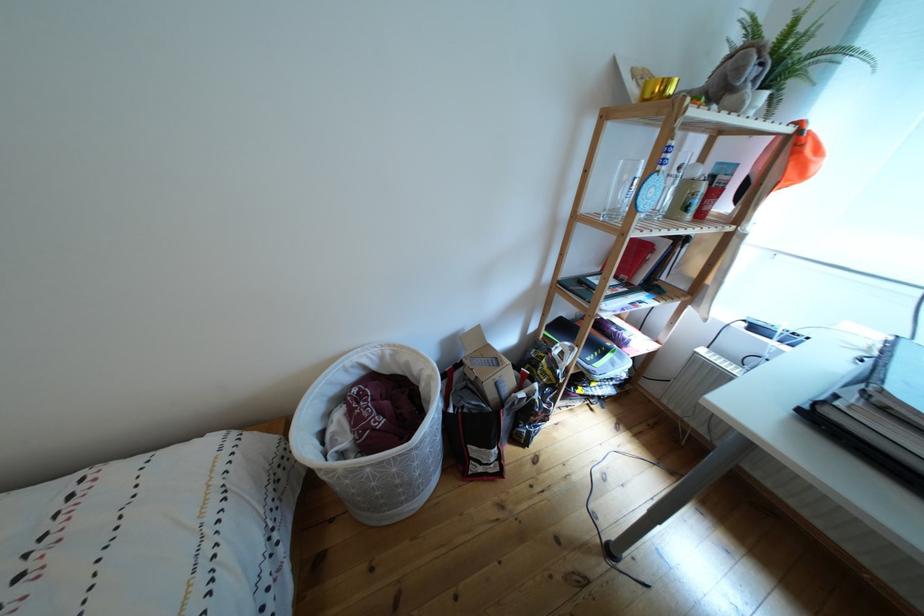
Find where to lift the orange baseball cap. Please return your answer as a coordinate pair (x, y).

(795, 156)